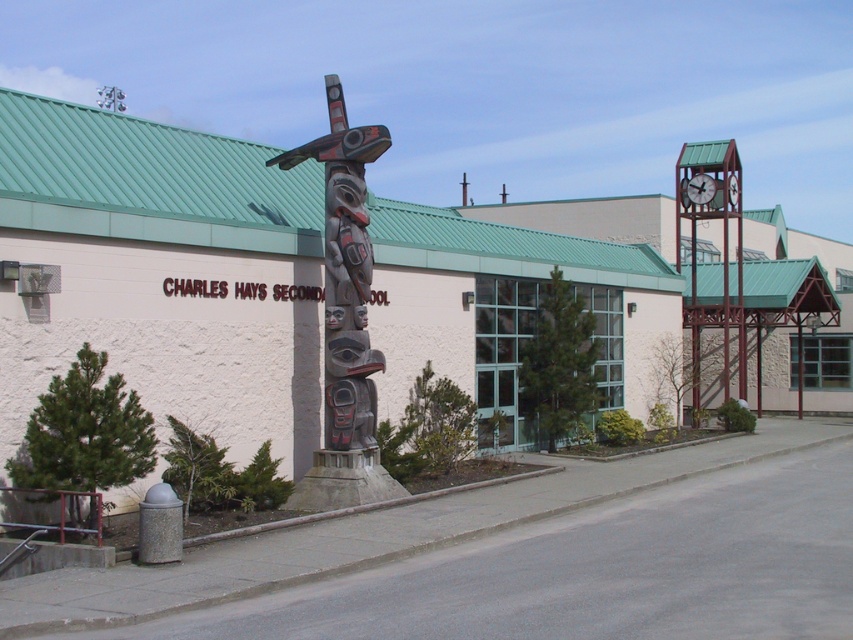
You are standing at the entrance of Charles Hays Secondary School and want to take a photo of the totem pole. If you move forward by 5 meters, will the point at point (325, 346) become closer to the camera?

The distance of point (325, 346) from camera is 15.78 meters. Moving forward by 5 meters would decrease the distance to 10.78 meters, so yes, the point at point (325, 346) would become closer to the camera.

You are a visitor approaching Charles Hays Secondary School and notice the carved wooden totem pole at center and the metallic clock at upper right. Which object is positioned higher up in the image?

The metallic clock at upper right is positioned higher up in the image than the carved wooden totem pole at center.